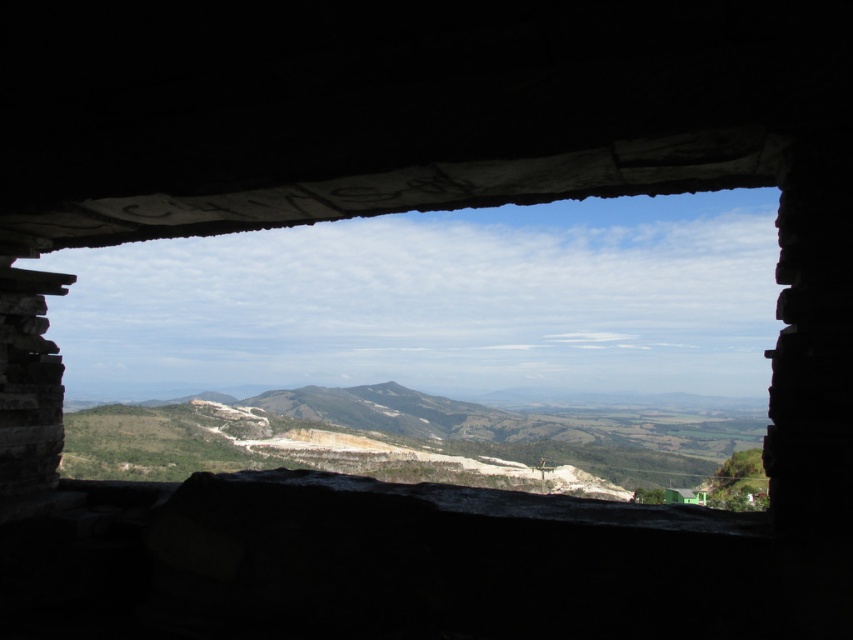
Identify the location of stone window at center. (444, 307).